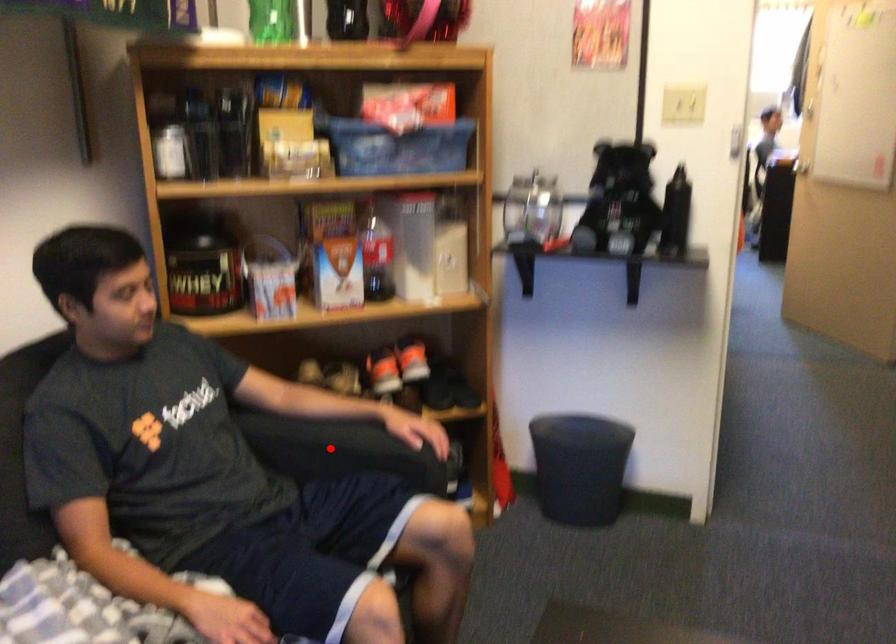
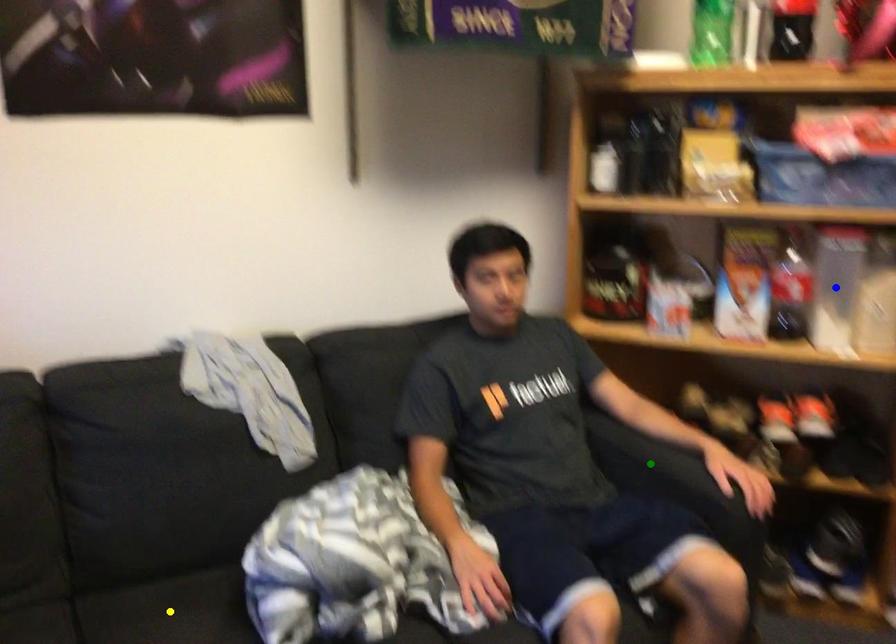
Question: I am providing you with two images of the same scene from different viewpoints. A red point is marked on the first image. You are given multiple points on the second image. Which point in image 2 represents the same 3d spot as the red point in image 1?

Choices:
 (A) yellow point
 (B) green point
 (C) blue point

Answer: (B)